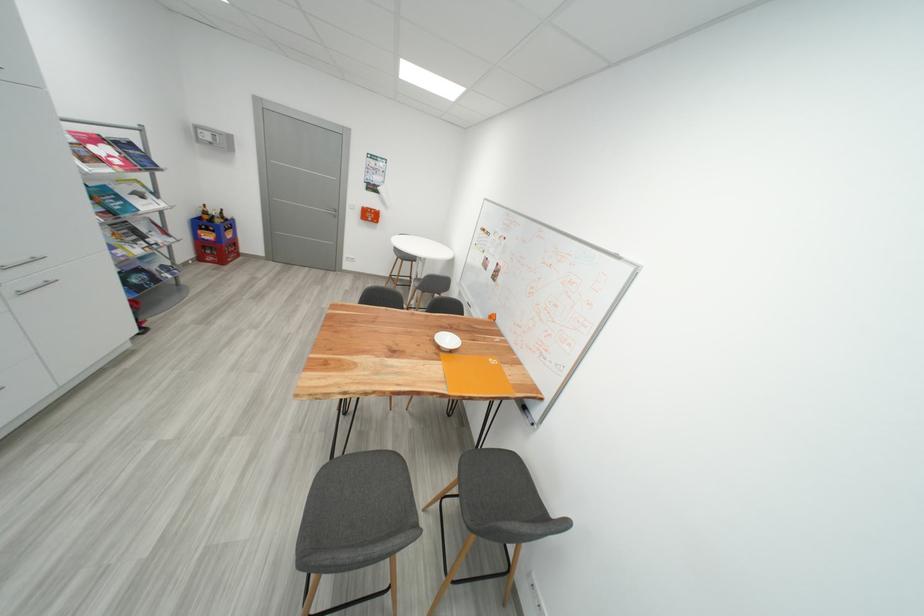
What do you see at coordinates (330, 211) in the screenshot? I see `the silver door handle` at bounding box center [330, 211].